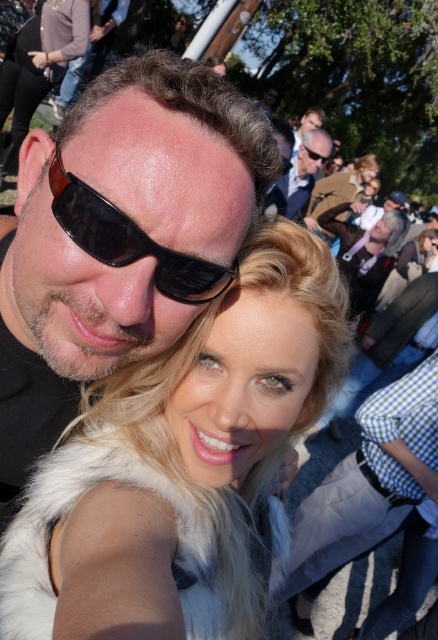
Question: Which of the following is the closest to the observer?

Choices:
 (A) matte black sunglasses at center
 (B) blonde fur coat at center
 (C) matte black sunglasses at upper left
 (D) black plastic sunglasses at upper center

Answer: (B)

Question: Can you confirm if matte black sunglasses at upper left is smaller than black plastic sunglasses at upper center?

Choices:
 (A) yes
 (B) no

Answer: (B)

Question: Which object is positioned closest to the black matte sunglasses at center?

Choices:
 (A) light brown leather jacket at upper center
 (B) matte black sunglasses at upper left

Answer: (B)

Question: Is light brown leather jacket at upper center positioned at the back of black plastic sunglasses at upper center?

Choices:
 (A) yes
 (B) no

Answer: (B)

Question: Based on their relative distances, which object is nearer to the blonde fur coat at center?

Choices:
 (A) black plastic sunglasses at upper center
 (B) light brown leather jacket at upper center

Answer: (B)

Question: Does blonde fur coat at center have a larger size compared to black matte sunglasses at center?

Choices:
 (A) no
 (B) yes

Answer: (B)